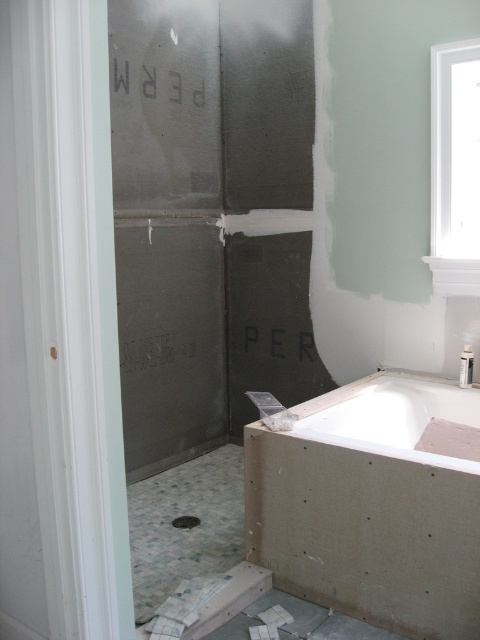
Can you confirm if white matte bathtub at lower right is smaller than white glossy bathtub at center?

No, white matte bathtub at lower right is not smaller than white glossy bathtub at center.

Does white matte bathtub at lower right have a lesser width compared to white glossy bathtub at center?

No.

Is point (399, 614) positioned in front of point (437, 465)?

No, it is not.

Identify the location of white matte bathtub at lower right. (371, 506).